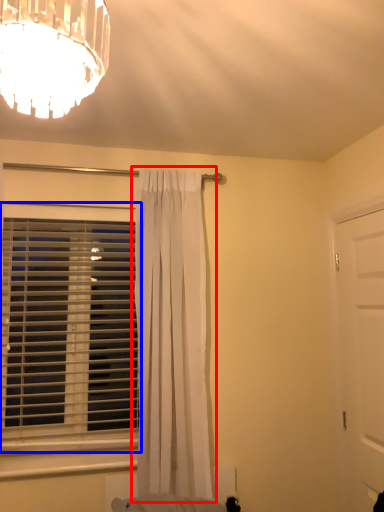
Question: Among these objects, which one is farthest to the camera, curtain (highlighted by a red box) or window blind (highlighted by a blue box)?

Choices:
 (A) curtain
 (B) window blind

Answer: (B)